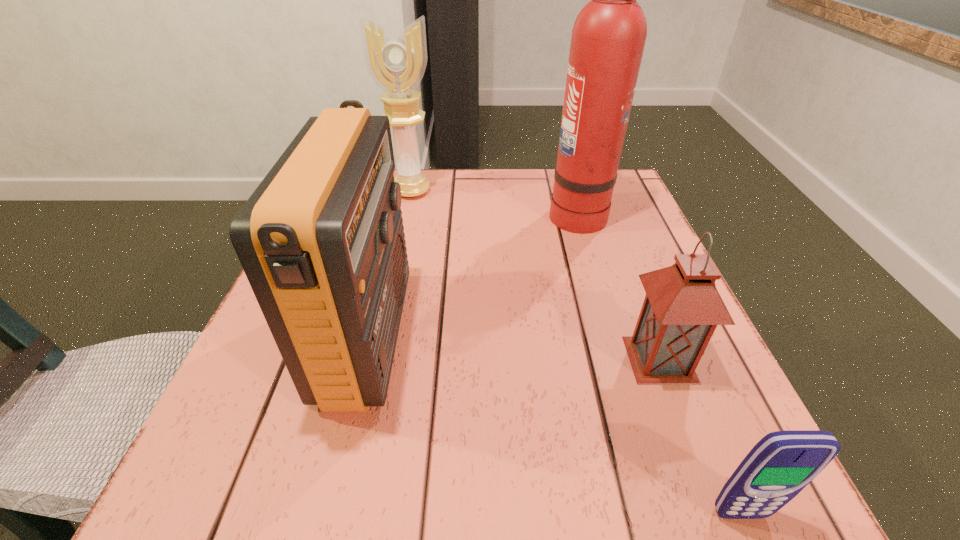
Where is `free point that satisfies the following two spatial constraints: 1. on the front-facing side of the award; 2. on the front-facing side of the radio receiver`? free point that satisfies the following two spatial constraints: 1. on the front-facing side of the award; 2. on the front-facing side of the radio receiver is located at coordinates (378, 338).

Where is `vacant position in the image that satisfies the following two spatial constraints: 1. on the front-facing side of the radio receiver; 2. on the left side of the lantern`? Image resolution: width=960 pixels, height=540 pixels. vacant position in the image that satisfies the following two spatial constraints: 1. on the front-facing side of the radio receiver; 2. on the left side of the lantern is located at coordinates (363, 360).